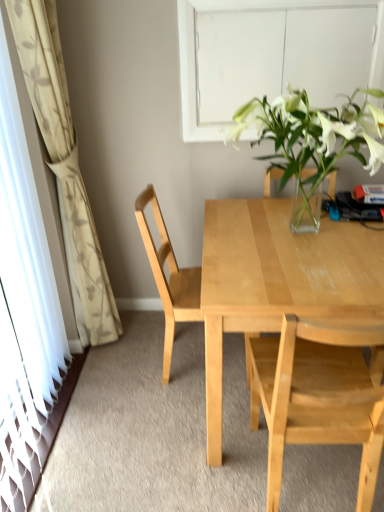
Locate an element on the screen. Image resolution: width=384 pixels, height=512 pixels. vacant space underneath white floral-patterned curtain at left (from a real-world perspective) is located at coordinates (103, 357).